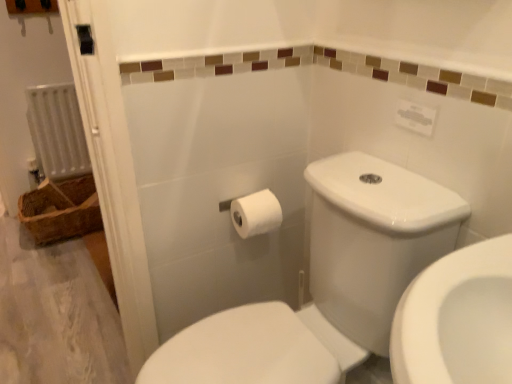
Question: Can you confirm if woven brown basket at left is positioned to the right of white glossy toilet at center?

Choices:
 (A) no
 (B) yes

Answer: (A)

Question: From a real-world perspective, does woven brown basket at left stand above white glossy toilet at center?

Choices:
 (A) no
 (B) yes

Answer: (A)

Question: Is woven brown basket at left oriented towards white glossy toilet at center?

Choices:
 (A) no
 (B) yes

Answer: (B)

Question: Considering the relative sizes of woven brown basket at left and white glossy toilet at center in the image provided, is woven brown basket at left smaller than white glossy toilet at center?

Choices:
 (A) yes
 (B) no

Answer: (A)

Question: Is woven brown basket at left outside white glossy toilet at center?

Choices:
 (A) no
 (B) yes

Answer: (B)

Question: From their relative heights in the image, would you say white plastic radiator at left is taller or shorter than woven brown basket at left?

Choices:
 (A) short
 (B) tall

Answer: (B)

Question: Would you say white plastic radiator at left is to the left or to the right of woven brown basket at left in the picture?

Choices:
 (A) right
 (B) left

Answer: (B)

Question: Is white plastic radiator at left in front of or behind woven brown basket at left in the image?

Choices:
 (A) behind
 (B) front

Answer: (A)

Question: From the image's perspective, is white plastic radiator at left located above or below woven brown basket at left?

Choices:
 (A) below
 (B) above

Answer: (B)

Question: From their relative heights in the image, would you say white matte toilet paper at center is taller or shorter than woven brown basket at left?

Choices:
 (A) short
 (B) tall

Answer: (A)

Question: In terms of size, does white matte toilet paper at center appear bigger or smaller than woven brown basket at left?

Choices:
 (A) big
 (B) small

Answer: (B)

Question: In terms of width, does white matte toilet paper at center look wider or thinner when compared to woven brown basket at left?

Choices:
 (A) thin
 (B) wide

Answer: (A)

Question: In the image, is white matte toilet paper at center positioned in front of or behind woven brown basket at left?

Choices:
 (A) front
 (B) behind

Answer: (A)

Question: Is white matte toilet paper at center situated inside white glossy toilet at center or outside?

Choices:
 (A) inside
 (B) outside

Answer: (B)

Question: From their relative heights in the image, would you say white matte toilet paper at center is taller or shorter than white glossy toilet at center?

Choices:
 (A) tall
 (B) short

Answer: (B)